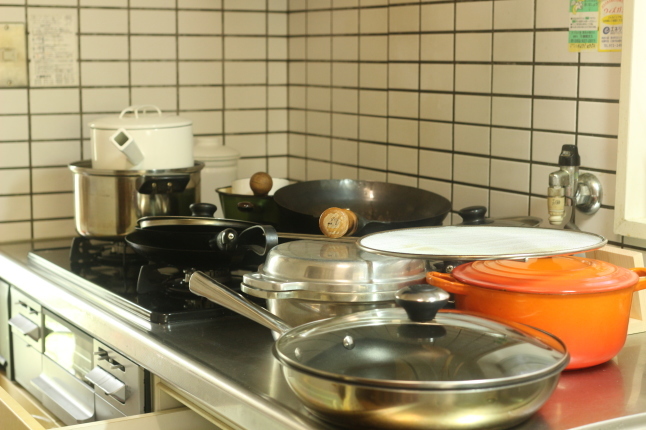
Identify the location of faucet. (561, 173).